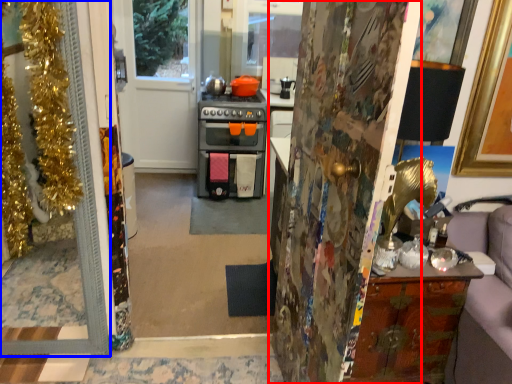
Question: Among these objects, which one is nearest to the camera, door (highlighted by a red box) or door (highlighted by a blue box)?

Choices:
 (A) door
 (B) door

Answer: (A)